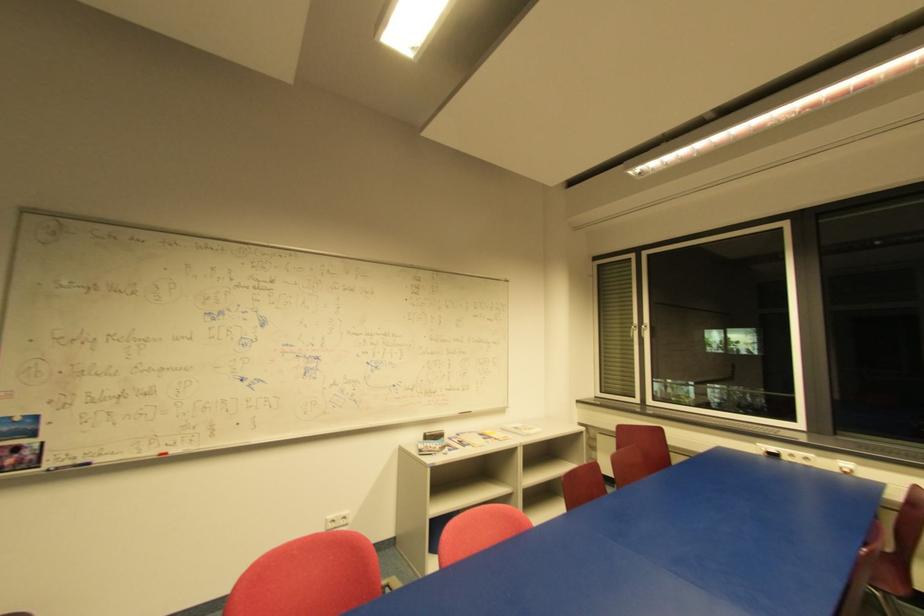
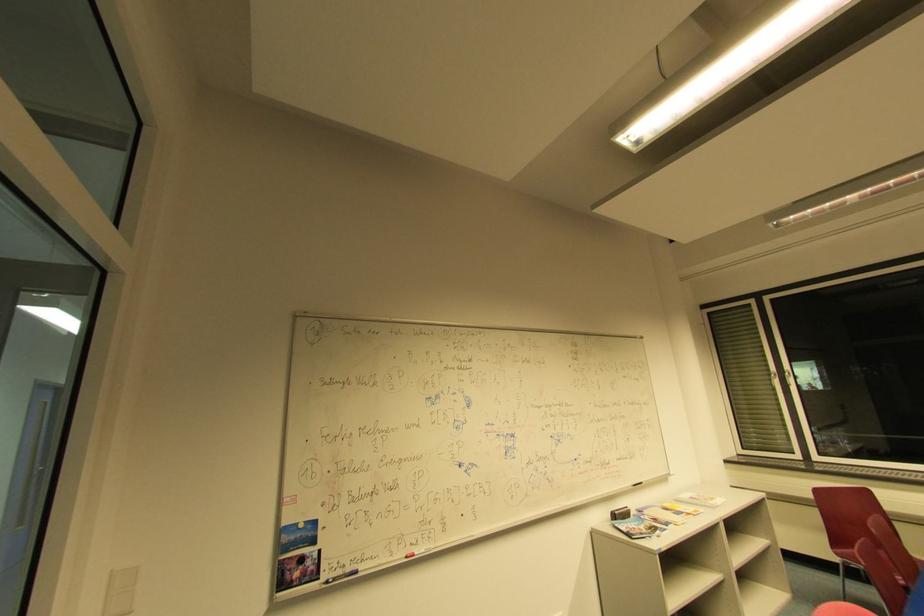
Locate, in the second image, the point that corresponds to (x=647, y=328) in the first image.

(791, 375)